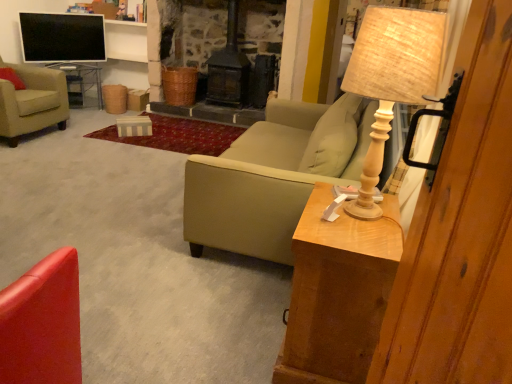
The image size is (512, 384). Describe the element at coordinates (32, 102) in the screenshot. I see `beige fabric armchair at left, placed as the first chair when sorted from left to right` at that location.

Find the location of a particular element. The image size is (512, 384). suede green couch at center is located at coordinates (268, 179).

This screenshot has width=512, height=384. Find the location of `wooden beige table lamp at right`. wooden beige table lamp at right is located at coordinates (391, 79).

The height and width of the screenshot is (384, 512). What are the coordinates of `flat screen tv at upper left` in the screenshot? It's located at (62, 37).

Find the location of `wooden side table at right, placed as the 2th table when sorted from back to front`. wooden side table at right, placed as the 2th table when sorted from back to front is located at coordinates (338, 292).

Find the location of `beige fabric armchair at left, placed as the second chair when sorted from bottom to top`. beige fabric armchair at left, placed as the second chair when sorted from bottom to top is located at coordinates (32, 102).

Considering the points (48, 36) and (28, 87), which point is behind, point (48, 36) or point (28, 87)?

The point (48, 36) is behind.

From a real-world perspective, which is physically below, flat screen tv at upper left or beige fabric armchair at left, placed as the first chair when sorted from left to right?

In real-world perspective, beige fabric armchair at left, placed as the first chair when sorted from left to right, is lower.

Relative to beige fabric armchair at left, marked as the second chair in a right-to-left arrangement, is flat screen tv at upper left in front or behind?

Visually, flat screen tv at upper left is located behind beige fabric armchair at left, marked as the second chair in a right-to-left arrangement.

Is point (95, 53) in front of point (84, 90)?

No.

Are flat screen tv at upper left and metal mesh table at left, the 2th table from the front, located far from each other?

They are positioned close to each other.

Is flat screen tv at upper left not inside metal mesh table at left, positioned as the 2th table in bottom-to-top order?

Yes, flat screen tv at upper left is located beyond the bounds of metal mesh table at left, positioned as the 2th table in bottom-to-top order.

Is flat screen tv at upper left taller or shorter than metal mesh table at left, the 2th table in the right-to-left sequence?

Considering their sizes, flat screen tv at upper left has more height than metal mesh table at left, the 2th table in the right-to-left sequence.

Which object is further away from the camera, wooden side table at right, placed as the 2th table when sorted from back to front, or shiny red chair at lower left, the first chair when ordered from bottom to top?

wooden side table at right, placed as the 2th table when sorted from back to front.

Based on the photo, what's the angular difference between wooden side table at right, which is the second table in top-to-bottom order, and shiny red chair at lower left, the first chair in the right-to-left sequence,'s facing directions?

The angle between the facing direction of wooden side table at right, which is the second table in top-to-bottom order, and the facing direction of shiny red chair at lower left, the first chair in the right-to-left sequence, is 68.8 degrees.

Can you confirm if wooden side table at right, which is the second table in top-to-bottom order, is smaller than shiny red chair at lower left, marked as the first chair in a front-to-back arrangement?

Yes, wooden side table at right, which is the second table in top-to-bottom order, is smaller than shiny red chair at lower left, marked as the first chair in a front-to-back arrangement.

Can we say wooden side table at right, which is the second table in top-to-bottom order, lies outside shiny red chair at lower left, positioned as the second chair in back-to-front order?

Yes, wooden side table at right, which is the second table in top-to-bottom order, is not within shiny red chair at lower left, positioned as the second chair in back-to-front order.

Consider the image. In the image, is shiny red chair at lower left, positioned as the second chair in back-to-front order, on the left side or the right side of wooden side table at right, placed as the 2th table when sorted from back to front?

shiny red chair at lower left, positioned as the second chair in back-to-front order, is positioned on wooden side table at right, placed as the 2th table when sorted from back to front,'s left side.

Locate an element on the screen. the 1st table above when counting from the shiny red chair at lower left, the first chair when ordered from bottom to top (from the image's perspective) is located at coordinates (338, 292).

Which of these two, shiny red chair at lower left, which is counted as the 2th chair, starting from the left, or wooden side table at right, placed as the 2th table when sorted from back to front, stands taller?

With more height is shiny red chair at lower left, which is counted as the 2th chair, starting from the left.

Is shiny red chair at lower left, which is counted as the 2th chair, starting from the left, with wooden side table at right, which is the second table in top-to-bottom order?

shiny red chair at lower left, which is counted as the 2th chair, starting from the left, and wooden side table at right, which is the second table in top-to-bottom order, are clearly separated.

Is point (378, 323) closer or farther from the camera than point (225, 217)?

Point (378, 323) appears to be closer to the viewer than point (225, 217).

Could you tell me if wooden side table at right, the second table in the left-to-right sequence, is facing suede green couch at center?

No.

In the scene shown: From a real-world perspective, is wooden side table at right, positioned as the first table in right-to-left order, over suede green couch at center?

No, from a real-world perspective, wooden side table at right, positioned as the first table in right-to-left order, is not above suede green couch at center.

Considering the sizes of wooden side table at right, positioned as the first table in right-to-left order, and suede green couch at center in the image, is wooden side table at right, positioned as the first table in right-to-left order, wider or thinner than suede green couch at center?

Considering their sizes, wooden side table at right, positioned as the first table in right-to-left order, looks slimmer than suede green couch at center.

Is beige fabric armchair at left, which is the first chair from top to bottom, taller or shorter than suede green couch at center?

A: In the image, beige fabric armchair at left, which is the first chair from top to bottom, appears to be taller than suede green couch at center.

In the image, there is a beige fabric armchair at left, placed as the second chair when sorted from bottom to top. In order to click on studio couch below it (from a real-world perspective) in this screenshot , I will do `click(268, 179)`.

From the picture: From a real-world perspective, relative to suede green couch at center, is beige fabric armchair at left, placed as the second chair when sorted from bottom to top, vertically above or below?

beige fabric armchair at left, placed as the second chair when sorted from bottom to top, is situated higher than suede green couch at center in the real world.

Does beige fabric armchair at left, the 2th chair when ordered from front to back, have a greater width compared to suede green couch at center?

Incorrect, the width of beige fabric armchair at left, the 2th chair when ordered from front to back, does not surpass that of suede green couch at center.

From a real-world perspective, between metal mesh table at left, the first table when ordered from back to front, and beige fabric armchair at left, marked as the second chair in a right-to-left arrangement, who is vertically lower?

From a 3D spatial view, metal mesh table at left, the first table when ordered from back to front, is below.

Find the location of a particular element. This screenshot has width=512, height=384. chair that is the 1st one when counting forward from the metal mesh table at left, the 2th table from the front is located at coordinates (32, 102).

From the image's perspective, is metal mesh table at left, positioned as the 2th table in bottom-to-top order, over beige fabric armchair at left, marked as the second chair in a right-to-left arrangement?

Indeed, from the image's perspective, metal mesh table at left, positioned as the 2th table in bottom-to-top order, is shown above beige fabric armchair at left, marked as the second chair in a right-to-left arrangement.

Does metal mesh table at left, the 2th table in the right-to-left sequence, have a greater width compared to beige fabric armchair at left, marked as the second chair in a right-to-left arrangement?

No, metal mesh table at left, the 2th table in the right-to-left sequence, is not wider than beige fabric armchair at left, marked as the second chair in a right-to-left arrangement.

From the image's perspective, starting from the flat screen tv at upper left, which chair is the 1st one below? Please provide its 2D coordinates.

[(32, 102)]

The image size is (512, 384). Identify the location of television lying above the metal mesh table at left, positioned as the 2th table in bottom-to-top order (from the image's perspective). (62, 37).

Which object lies nearer to the anchor point shiny red chair at lower left, placed as the 2th chair when sorted from top to bottom, wooden side table at right, the second table in the left-to-right sequence, or flat screen tv at upper left?

wooden side table at right, the second table in the left-to-right sequence, lies closer to shiny red chair at lower left, placed as the 2th chair when sorted from top to bottom, than the other object.

When comparing their distances from wooden side table at right, placed as the 2th table when sorted from back to front, does flat screen tv at upper left or wooden beige table lamp at right seem closer?

Among the two, wooden beige table lamp at right is located nearer to wooden side table at right, placed as the 2th table when sorted from back to front.

Considering their positions, is metal mesh table at left, the first table when ordered from back to front, positioned further to beige fabric armchair at left, the 2th chair when ordered from front to back, than shiny red chair at lower left, placed as the 2th chair when sorted from top to bottom?

Among the two, shiny red chair at lower left, placed as the 2th chair when sorted from top to bottom, is located further to beige fabric armchair at left, the 2th chair when ordered from front to back.

Which object lies further to the anchor point beige fabric armchair at left, placed as the first chair when sorted from left to right, wooden beige table lamp at right or flat screen tv at upper left?

wooden beige table lamp at right is further to beige fabric armchair at left, placed as the first chair when sorted from left to right.

Estimate the real-world distances between objects in this image. Which object is further from flat screen tv at upper left, wooden side table at right, the second table in the left-to-right sequence, or metal mesh table at left, which is the first table from top to bottom?

wooden side table at right, the second table in the left-to-right sequence, is further to flat screen tv at upper left.

Estimate the real-world distances between objects in this image. Which object is further from wooden beige table lamp at right, wooden side table at right, placed as the 2th table when sorted from back to front, or flat screen tv at upper left?

flat screen tv at upper left is further to wooden beige table lamp at right.

Based on their spatial positions, is metal mesh table at left, the 2th table in the right-to-left sequence, or beige fabric armchair at left, the 2th chair when ordered from front to back, further from suede green couch at center?

Based on the image, metal mesh table at left, the 2th table in the right-to-left sequence, appears to be further to suede green couch at center.

From the picture: Estimate the real-world distances between objects in this image. Which object is closer to suede green couch at center, wooden beige table lamp at right or shiny red chair at lower left, the first chair in the right-to-left sequence?

Among the two, wooden beige table lamp at right is located nearer to suede green couch at center.

Locate an element on the screen. table between shiny red chair at lower left, positioned as the second chair in back-to-front order, and flat screen tv at upper left, along the z-axis is located at coordinates (338, 292).

Where is `chair positioned between wooden side table at right, the second table in the left-to-right sequence, and flat screen tv at upper left from near to far`? This screenshot has height=384, width=512. chair positioned between wooden side table at right, the second table in the left-to-right sequence, and flat screen tv at upper left from near to far is located at coordinates (32, 102).

The image size is (512, 384). I want to click on studio couch between wooden beige table lamp at right and flat screen tv at upper left along the z-axis, so click(x=268, y=179).

Identify the location of table between shiny red chair at lower left, placed as the 2th chair when sorted from top to bottom, and wooden beige table lamp at right. (338, 292).